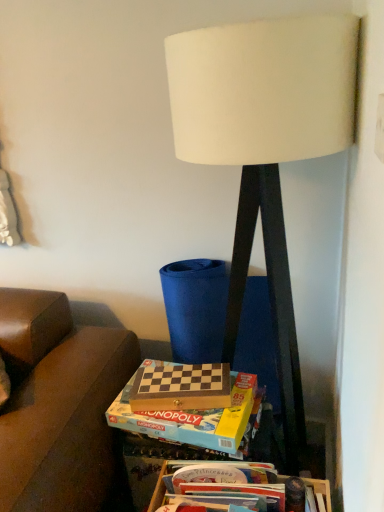
Identify the location of wooden chess set at center, positioned as the 2th box in bottom-to-top order. The width and height of the screenshot is (384, 512). (192, 419).

The height and width of the screenshot is (512, 384). Identify the location of wooden chessboard at center. (181, 388).

Measure the distance between wooden chessboard at center and camera.

wooden chessboard at center and camera are 3.99 feet apart from each other.

Identify the location of white fabric lampshade at center. (265, 147).

Measure the distance between point (308, 106) and camera.

Point (308, 106) is 35.20 inches away from camera.

Locate an element on the screen. wooden board game at lower center, which appears as the second box when viewed from the top is located at coordinates (320, 492).

What are the coordinates of `wooden board game at center` in the screenshot? It's located at (188, 430).

Which object is further away from the camera, white fabric lampshade at center or wooden chess set at center, acting as the first box starting from the top?

wooden chess set at center, acting as the first box starting from the top, is behind.

From a real-world perspective, is white fabric lampshade at center over wooden chess set at center, acting as the first box starting from the top?

Yes, from a real-world perspective, white fabric lampshade at center is above wooden chess set at center, acting as the first box starting from the top.

Is point (273, 123) closer or farther from the camera than point (207, 419)?

Point (273, 123) is positioned closer to the camera compared to point (207, 419).

Can you see white fabric lampshade at center touching wooden chess set at center, acting as the first box starting from the top?

No.

Is wooden board game at center directly adjacent to wooden chess set at center, positioned as the 2th box in bottom-to-top order?

Yes, the surface of wooden board game at center is in contact with wooden chess set at center, positioned as the 2th box in bottom-to-top order.

Is wooden board game at center at the left side of wooden chess set at center, acting as the first box starting from the top?

In fact, wooden board game at center is to the right of wooden chess set at center, acting as the first box starting from the top.

Considering the positions of objects wooden board game at center and wooden chess set at center, acting as the first box starting from the top, in the image provided, who is behind, wooden board game at center or wooden chess set at center, acting as the first box starting from the top,?

wooden board game at center is more distant.

Does point (116, 409) lie behind point (225, 430)?

That is True.

Relative to white fabric lampshade at center, is wooden board game at center in front or behind?

wooden board game at center is behind white fabric lampshade at center.

Does wooden board game at center appear on the right side of white fabric lampshade at center?

No.

Does point (154, 457) come closer to viewer compared to point (261, 112)?

No, (154, 457) is behind (261, 112).

Looking at their sizes, would you say wooden board game at center is wider or thinner than white fabric lampshade at center?

wooden board game at center is thinner than white fabric lampshade at center.

Is white fabric lampshade at center at the left side of wooden board game at center?

No, white fabric lampshade at center is not to the left of wooden board game at center.

From the image's perspective, is white fabric lampshade at center under wooden board game at center?

No, from the image's perspective, white fabric lampshade at center is not below wooden board game at center.

Can you confirm if white fabric lampshade at center is thinner than wooden board game at center?

No.

Is white fabric lampshade at center in front of wooden board game at center?

Yes, white fabric lampshade at center is closer to the camera.

Is point (164, 390) more distant than point (210, 417)?

Yes, point (164, 390) is farther from viewer.

From a real-world perspective, is wooden chessboard at center above or below wooden chess set at center, positioned as the 2th box in bottom-to-top order?

In terms of real-world spatial position, wooden chessboard at center is above wooden chess set at center, positioned as the 2th box in bottom-to-top order.

Does wooden chessboard at center turn towards wooden chess set at center, positioned as the 2th box in bottom-to-top order?

No, wooden chessboard at center does not turn towards wooden chess set at center, positioned as the 2th box in bottom-to-top order.

Can you confirm if wooden chessboard at center is shorter than wooden chess set at center, acting as the first box starting from the top?

Yes, wooden chessboard at center is shorter than wooden chess set at center, acting as the first box starting from the top.

Is wooden board game at center aimed at wooden chessboard at center?

No, wooden board game at center is not facing towards wooden chessboard at center.

Looking at this image, is wooden board game at center placed right next to wooden chessboard at center?

Indeed, wooden board game at center and wooden chessboard at center are beside each other and touching.

Is point (111, 418) in front of point (222, 407)?

No, (111, 418) is further to viewer.

From the image's perspective, is wooden board game at center above or below wooden chessboard at center?

Based on their image positions, wooden board game at center is located beneath wooden chessboard at center.

From a real-world perspective, does wooden chessboard at center sit lower than white fabric lampshade at center?

Yes.

Based on the photo, from the image's perspective, is wooden chessboard at center located above or below white fabric lampshade at center?

Based on their image positions, wooden chessboard at center is located beneath white fabric lampshade at center.

Considering the relative positions of wooden chessboard at center and white fabric lampshade at center in the image provided, is wooden chessboard at center to the right of white fabric lampshade at center from the viewer's perspective?

No, wooden chessboard at center is not to the right of white fabric lampshade at center.

Is wooden chessboard at center thinner than white fabric lampshade at center?

Correct, the width of wooden chessboard at center is less than that of white fabric lampshade at center.

From the image's perspective, starting from the white fabric lampshade at center, which box is the 1st one below? Please provide its 2D coordinates.

[(192, 419)]

What are the coordinates of `table behind the wooden chess set at center, acting as the first box starting from the top` in the screenshot? It's located at (188, 430).

Which object lies nearer to the anchor point white fabric lampshade at center, wooden chessboard at center or wooden board game at center?

Based on the image, wooden board game at center appears to be nearer to white fabric lampshade at center.

Estimate the real-world distances between objects in this image. Which object is closer to wooden board game at center, white fabric lampshade at center or wooden chess set at center, acting as the first box starting from the top?

wooden chess set at center, acting as the first box starting from the top.

In the scene shown: When comparing their distances from wooden board game at center, does wooden board game at lower center, which is the first box in bottom-to-top order, or white fabric lampshade at center seem closer?

wooden board game at lower center, which is the first box in bottom-to-top order, is closer to wooden board game at center.

Based on their spatial positions, is white fabric lampshade at center or wooden board game at lower center, which is the first box in bottom-to-top order, further from wooden chessboard at center?

white fabric lampshade at center.

When comparing their distances from white fabric lampshade at center, does wooden board game at center or wooden board game at lower center, which appears as the second box when viewed from the top, seem further?

wooden board game at lower center, which appears as the second box when viewed from the top, is further to white fabric lampshade at center.

Which object lies further to the anchor point wooden board game at center, wooden chess set at center, acting as the first box starting from the top, or white fabric lampshade at center?

white fabric lampshade at center is further to wooden board game at center.

Based on their spatial positions, is wooden board game at lower center, which appears as the second box when viewed from the top, or wooden board game at center further from wooden chessboard at center?

wooden board game at lower center, which appears as the second box when viewed from the top, is further to wooden chessboard at center.

Consider the image. Considering their positions, is wooden board game at lower center, which is the first box in bottom-to-top order, positioned further to wooden chess set at center, positioned as the 2th box in bottom-to-top order, than wooden chessboard at center?

wooden board game at lower center, which is the first box in bottom-to-top order, is further to wooden chess set at center, positioned as the 2th box in bottom-to-top order.

You are a GUI agent. You are given a task and a screenshot of the screen. Output one action in this format:
    pyautogui.click(x=<x>, y=<y>)
    Task: Click on the paperback book that lies between white fabric lampshade at center and wooden board game at lower center, which is the first box in bottom-to-top order, from top to bottom
    This screenshot has width=384, height=512.
    Given the screenshot: What is the action you would take?
    pyautogui.click(x=181, y=388)

Identify the location of table between white fabric lampshade at center and wooden board game at lower center, which is the first box in bottom-to-top order, in the vertical direction. (188, 430).

The height and width of the screenshot is (512, 384). In order to click on box between wooden chessboard at center and wooden board game at lower center, which appears as the second box when viewed from the top, vertically in this screenshot , I will do `click(192, 419)`.

You are a GUI agent. You are given a task and a screenshot of the screen. Output one action in this format:
    pyautogui.click(x=<x>, y=<y>)
    Task: Click on the table between wooden chess set at center, acting as the first box starting from the top, and wooden board game at lower center, which appears as the second box when viewed from the top, from top to bottom
    
    Given the screenshot: What is the action you would take?
    pyautogui.click(x=188, y=430)